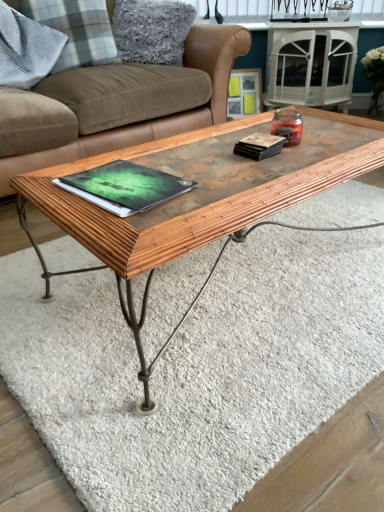
This screenshot has height=512, width=384. Find the location of `free point above green matte book at center, which appears as the 2th book when viewed from the top (from a real-world perspective)`. free point above green matte book at center, which appears as the 2th book when viewed from the top (from a real-world perspective) is located at coordinates (127, 176).